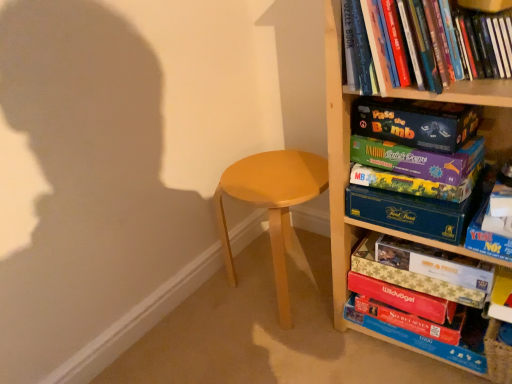
Question: Would you say red matte board game at lower right, acting as the first paperback book starting from the bottom, is outside gold foil puzzle box at lower right, the fifth paperback book in the top-to-bottom sequence?

Choices:
 (A) yes
 (B) no

Answer: (A)

Question: Is red matte board game at lower right, acting as the 7th paperback book starting from the top, turned away from gold foil puzzle box at lower right, which ranks as the third paperback book in bottom-to-top order?

Choices:
 (A) yes
 (B) no

Answer: (B)

Question: Are red matte board game at lower right, acting as the first paperback book starting from the bottom, and gold foil puzzle box at lower right, the fifth paperback book in the top-to-bottom sequence, beside each other?

Choices:
 (A) yes
 (B) no

Answer: (B)

Question: Is red matte board game at lower right, acting as the 7th paperback book starting from the top, taller than gold foil puzzle box at lower right, the fifth paperback book in the top-to-bottom sequence?

Choices:
 (A) yes
 (B) no

Answer: (B)

Question: Is red matte board game at lower right, acting as the first paperback book starting from the bottom, closer to the viewer compared to gold foil puzzle box at lower right, the fifth paperback book in the top-to-bottom sequence?

Choices:
 (A) no
 (B) yes

Answer: (A)

Question: In terms of size, does gold foil puzzle box at lower right, the fifth paperback book in the top-to-bottom sequence, appear bigger or smaller than matte purple board game at center-right, which appears as the fifth paperback book when ordered from the bottom?

Choices:
 (A) big
 (B) small

Answer: (A)

Question: Which is correct: gold foil puzzle box at lower right, which ranks as the third paperback book in bottom-to-top order, is inside matte purple board game at center-right, which appears as the third paperback book when viewed from the top, or outside of it?

Choices:
 (A) outside
 (B) inside

Answer: (A)

Question: Based on their positions, is gold foil puzzle box at lower right, which ranks as the third paperback book in bottom-to-top order, located to the left or right of matte purple board game at center-right, which appears as the fifth paperback book when ordered from the bottom?

Choices:
 (A) left
 (B) right

Answer: (B)

Question: Looking at their shapes, would you say gold foil puzzle box at lower right, which ranks as the third paperback book in bottom-to-top order, is wider or thinner than matte purple board game at center-right, which appears as the fifth paperback book when ordered from the bottom?

Choices:
 (A) wide
 (B) thin

Answer: (A)

Question: Does point (492, 46) appear closer or farther from the camera than point (409, 311)?

Choices:
 (A) closer
 (B) farther

Answer: (A)

Question: Considering the positions of hardcover book at upper right, the second book in the top-to-bottom sequence, and red matte board game at lower right, the 6th paperback book from the top, in the image, is hardcover book at upper right, the second book in the top-to-bottom sequence, wider or thinner than red matte board game at lower right, the 6th paperback book from the top,?

Choices:
 (A) thin
 (B) wide

Answer: (B)

Question: From their relative heights in the image, would you say hardcover book at upper right, the second book in the top-to-bottom sequence, is taller or shorter than red matte board game at lower right, the 6th paperback book from the top?

Choices:
 (A) tall
 (B) short

Answer: (A)

Question: Is hardcover book at upper right, which appears as the second book when ordered from the bottom, in front of or behind red matte board game at lower right, which appears as the second paperback book when ordered from the bottom, in the image?

Choices:
 (A) front
 (B) behind

Answer: (A)

Question: Do you think wooden bookcase at right is within red matte board game at lower right, which appears as the second paperback book when ordered from the bottom, or outside of it?

Choices:
 (A) outside
 (B) inside

Answer: (A)

Question: Would you say wooden bookcase at right is to the left or to the right of red matte board game at lower right, which appears as the second paperback book when ordered from the bottom, in the picture?

Choices:
 (A) right
 (B) left

Answer: (A)